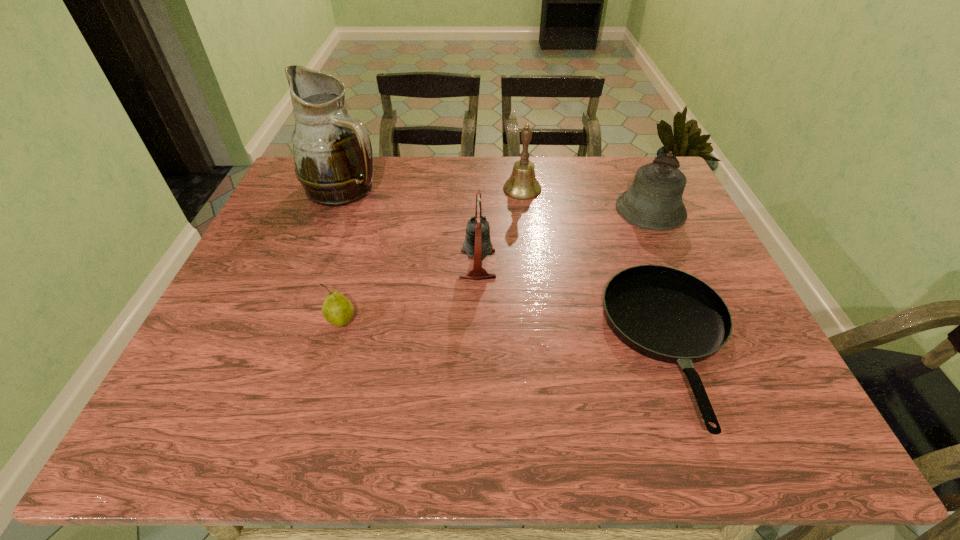
Locate an element on the screen. vacant area in the image that satisfies the following two spatial constraints: 1. from the spout of the third object from right to left; 2. on the left side of the pitcher is located at coordinates (346, 189).

You are a GUI agent. You are given a task and a screenshot of the screen. Output one action in this format:
    pyautogui.click(x=<x>, y=<y>)
    Task: Click on the free space that satisfies the following two spatial constraints: 1. on the back side of the rightmost bell; 2. from the spout of the pitcher
    
    Given the screenshot: What is the action you would take?
    click(x=641, y=188)

At what (x,y) coordinates should I click in order to perform the action: click on free space that satisfies the following two spatial constraints: 1. from the spout of the tallest object; 2. on the left side of the pear. Please return your answer as a coordinate pair (x, y). Looking at the image, I should click on (295, 322).

I want to click on blank area in the image that satisfies the following two spatial constraints: 1. from the spout of the tallest object; 2. on the back side of the second bell from left to right, so click(x=346, y=189).